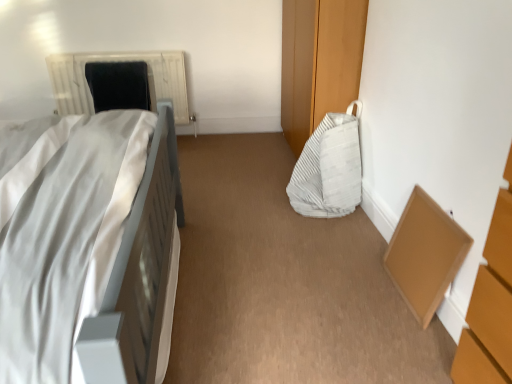
Question: From a real-world perspective, is black fabric bean bag at upper left, which appears as the 1th bean bag chair when viewed from the back, positioned above or below white matte bed at left?

Choices:
 (A) above
 (B) below

Answer: (B)

Question: Is black fabric bean bag at upper left, the second bean bag chair viewed from the right, wider or thinner than white matte bed at left?

Choices:
 (A) thin
 (B) wide

Answer: (A)

Question: Estimate the real-world distances between objects in this image. Which object is farther from the white textured radiator at upper left?

Choices:
 (A) brown cardboard box at lower right
 (B) black fabric bean bag at upper left, which appears as the 1th bean bag chair when viewed from the back
 (C) white striped fabric bean bag at center-right, which is the 2th bean bag chair from left to right
 (D) white matte bed at left

Answer: (A)

Question: Estimate the real-world distances between objects in this image. Which object is farther from the white matte bed at left?

Choices:
 (A) white striped fabric bean bag at center-right, arranged as the first bean bag chair when viewed from the front
 (B) white textured radiator at upper left
 (C) black fabric bean bag at upper left, which is the second bean bag chair in bottom-to-top order
 (D) brown cardboard box at lower right

Answer: (B)